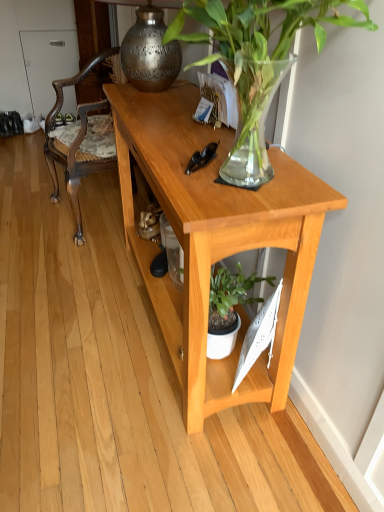
Question: Is light wood desk at center facing towards wooden carved chair at left?

Choices:
 (A) yes
 (B) no

Answer: (B)

Question: From a real-world perspective, does light wood desk at center sit lower than wooden carved chair at left?

Choices:
 (A) yes
 (B) no

Answer: (A)

Question: Are light wood desk at center and wooden carved chair at left beside each other?

Choices:
 (A) yes
 (B) no

Answer: (B)

Question: Does light wood desk at center have a greater width compared to wooden carved chair at left?

Choices:
 (A) yes
 (B) no

Answer: (B)

Question: Is light wood desk at center to the right of wooden carved chair at left from the viewer's perspective?

Choices:
 (A) yes
 (B) no

Answer: (A)

Question: Looking at the image, does polished brass lamp at upper center seem bigger or smaller compared to light wood desk at center?

Choices:
 (A) big
 (B) small

Answer: (B)

Question: Would you say polished brass lamp at upper center is inside or outside light wood desk at center?

Choices:
 (A) inside
 (B) outside

Answer: (B)

Question: From the image's perspective, is polished brass lamp at upper center positioned above or below light wood desk at center?

Choices:
 (A) above
 (B) below

Answer: (A)

Question: Is point (165, 80) closer or farther from the camera than point (201, 200)?

Choices:
 (A) farther
 (B) closer

Answer: (A)

Question: In terms of height, does green glossy plant at upper center look taller or shorter compared to polished brass lamp at upper center?

Choices:
 (A) short
 (B) tall

Answer: (B)

Question: From the image's perspective, relative to polished brass lamp at upper center, is green glossy plant at upper center above or below?

Choices:
 (A) above
 (B) below

Answer: (B)

Question: Looking at their shapes, would you say green glossy plant at upper center is wider or thinner than polished brass lamp at upper center?

Choices:
 (A) wide
 (B) thin

Answer: (A)

Question: In the image, is green glossy plant at upper center positioned in front of or behind polished brass lamp at upper center?

Choices:
 (A) behind
 (B) front

Answer: (B)

Question: Is light wood desk at center taller or shorter than wooden carved chair at left?

Choices:
 (A) tall
 (B) short

Answer: (B)

Question: Is light wood desk at center to the left or to the right of wooden carved chair at left in the image?

Choices:
 (A) right
 (B) left

Answer: (A)